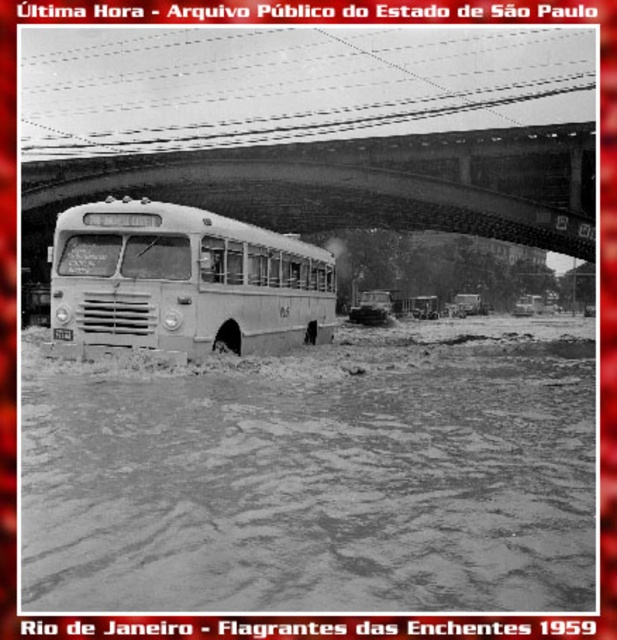
Question: Is the position of muddy water at lower center less distant than that of white matte school bus at center?

Choices:
 (A) no
 (B) yes

Answer: (B)

Question: Which of the following is the farthest from the observer?

Choices:
 (A) muddy water at lower center
 (B) white matte school bus at center

Answer: (B)

Question: Can you confirm if muddy water at lower center is thinner than smooth concrete bridge at center?

Choices:
 (A) yes
 (B) no

Answer: (A)

Question: Does muddy water at lower center have a larger size compared to white matte school bus at center?

Choices:
 (A) yes
 (B) no

Answer: (A)

Question: Which point is closer to the camera taking this photo?

Choices:
 (A) (465, 170)
 (B) (172, 260)

Answer: (B)

Question: Among these objects, which one is nearest to the camera?

Choices:
 (A) white matte school bus at center
 (B) smooth concrete bridge at center

Answer: (A)